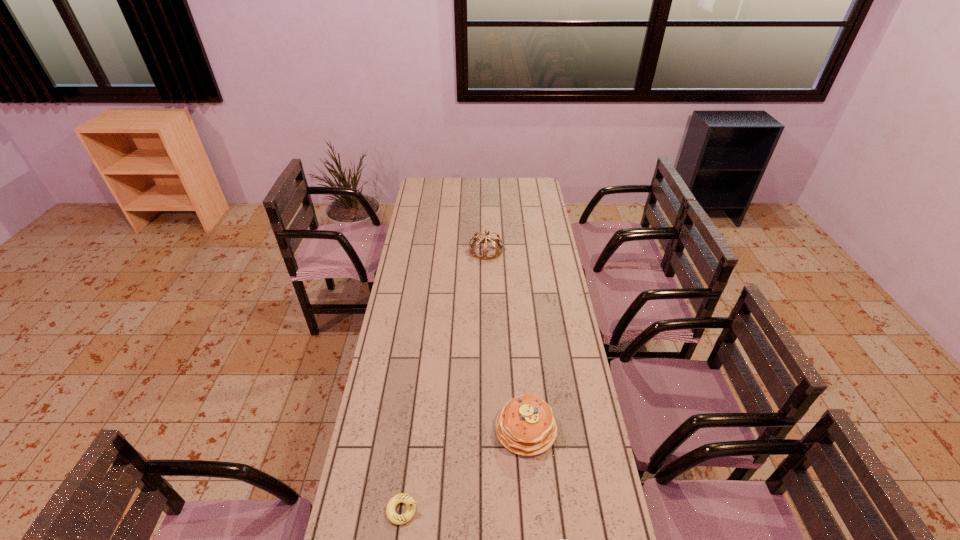
The width and height of the screenshot is (960, 540). Identify the location of vacant space at the far edge. (504, 197).

Locate an element on the screen. This screenshot has width=960, height=540. free space at the left edge is located at coordinates (421, 200).

Locate an element on the screen. The image size is (960, 540). blank space at the right edge of the desktop is located at coordinates (541, 385).

Find the location of a particular element. This screenshot has width=960, height=540. vacant space in between the duckling and the farthest object is located at coordinates click(x=444, y=380).

Identify the location of free area in between the duckling and the farthest object. The width and height of the screenshot is (960, 540). tap(444, 380).

I want to click on unoccupied position between the tiara and the leftmost object, so click(x=444, y=380).

Find the location of a particular element. The width and height of the screenshot is (960, 540). unoccupied position between the duckling and the taller pancake is located at coordinates (465, 469).

Find the location of a particular element. object that stands as the second closest to the duckling is located at coordinates (558, 539).

Choose which object is the third nearest neighbor to the farthest object. Please provide its 2D coordinates. Your answer should be formatted as a tuple, i.e. [(x, y)], where the tuple contains the x and y coordinates of a point satisfying the conditions above.

[(558, 539)]